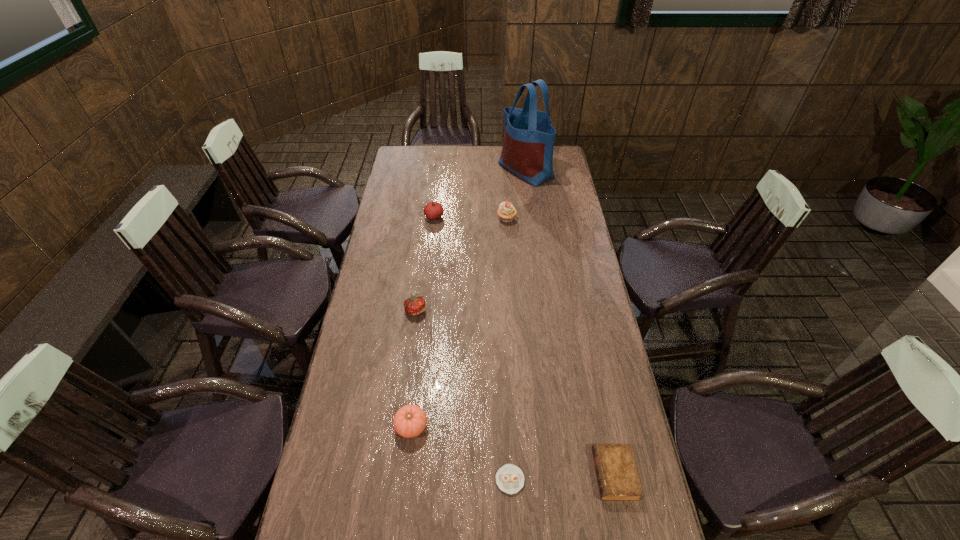
Image resolution: width=960 pixels, height=540 pixels. What are the coordinates of `the tallest object` in the screenshot? It's located at (527, 151).

Where is `the farthest object`? This screenshot has height=540, width=960. the farthest object is located at coordinates (527, 151).

Locate an element on the screen. Image resolution: width=960 pixels, height=540 pixels. the farther cupcake is located at coordinates (506, 212).

Locate an element on the screen. This screenshot has height=540, width=960. the taller cupcake is located at coordinates (506, 212).

Where is `the third tallest object`? Image resolution: width=960 pixels, height=540 pixels. the third tallest object is located at coordinates (433, 210).

Find the location of a particular element. The height and width of the screenshot is (540, 960). the farthest tomato is located at coordinates (433, 210).

This screenshot has height=540, width=960. I want to click on the nearest tomato, so click(410, 420).

Find the location of a particular element. This screenshot has height=540, width=960. the fourth farthest object is located at coordinates (414, 305).

I want to click on diary, so coord(617,476).

Find the location of a particular element. The height and width of the screenshot is (540, 960). the nearer cupcake is located at coordinates (509, 478).